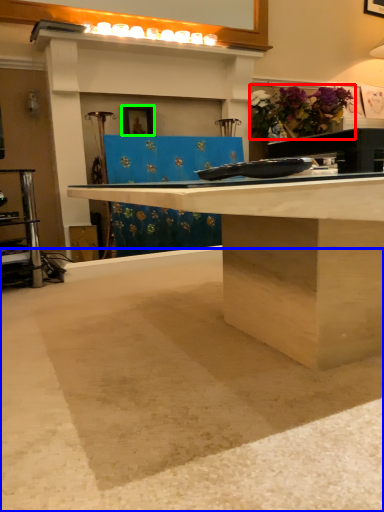
Question: Based on their relative distances, which object is farther from flower (highlighted by a red box)? Choose from concrete (highlighted by a blue box) and picture frame (highlighted by a green box).

Choices:
 (A) concrete
 (B) picture frame

Answer: (A)